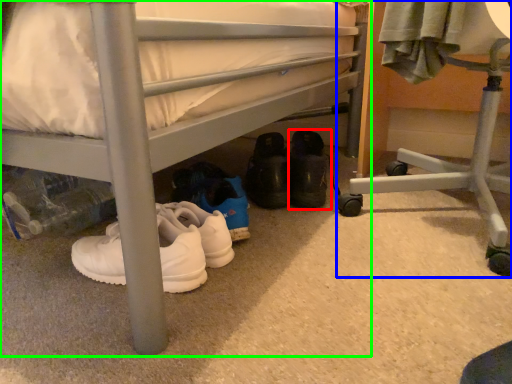
Question: Estimate the real-world distances between objects in this image. Which object is farther from footwear (highlighted by a red box), furniture (highlighted by a blue box) or bed (highlighted by a green box)?

Choices:
 (A) furniture
 (B) bed

Answer: (B)